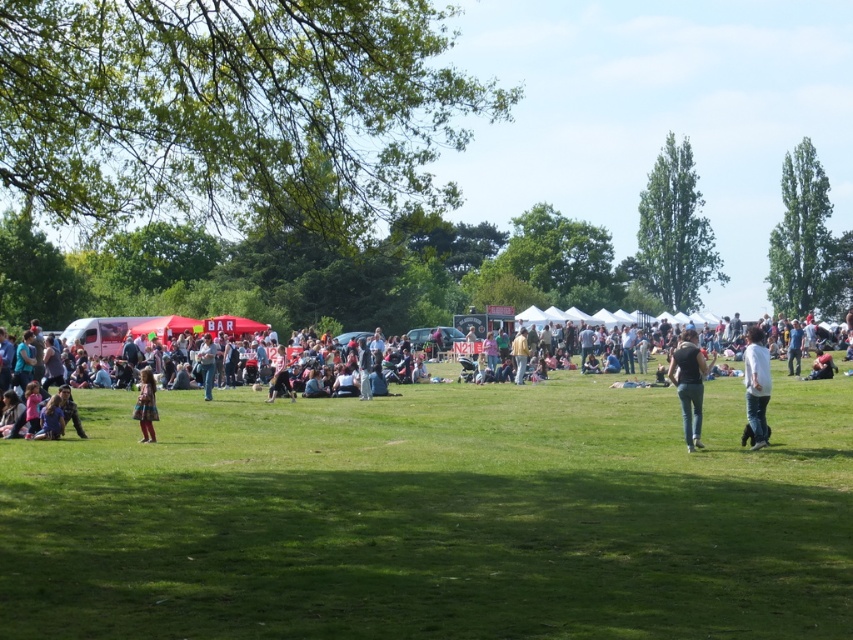
Question: Is white cotton shirt at right to the left of plaid fabric dress at lower left from the viewer's perspective?

Choices:
 (A) yes
 (B) no

Answer: (B)

Question: Which point is farther from the camera taking this photo?

Choices:
 (A) 759,332
 (B) 689,372

Answer: (A)

Question: Estimate the real-world distances between objects in this image. Which object is farther from the jeans at center?

Choices:
 (A) white cotton shirt at right
 (B) plaid fabric dress at lower left

Answer: (B)

Question: Which point is farther to the camera?

Choices:
 (A) (303, 564)
 (B) (763, 413)

Answer: (B)

Question: Considering the relative positions of green grass at center and dark gray jeans at center in the image provided, where is green grass at center located with respect to dark gray jeans at center?

Choices:
 (A) right
 (B) left

Answer: (B)

Question: Is jeans at center wider than plaid fabric dress at lower left?

Choices:
 (A) yes
 (B) no

Answer: (A)